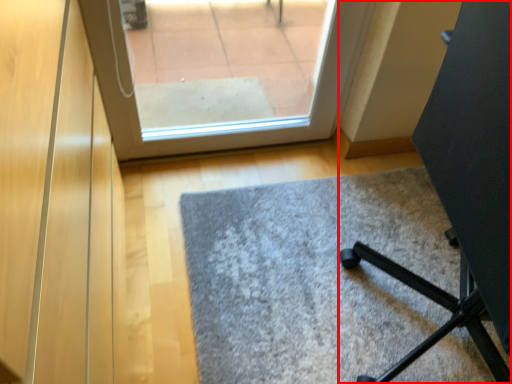
Question: Observing the image, what is the correct spatial positioning of furniture (annotated by the red box) in reference to door?

Choices:
 (A) left
 (B) right

Answer: (B)